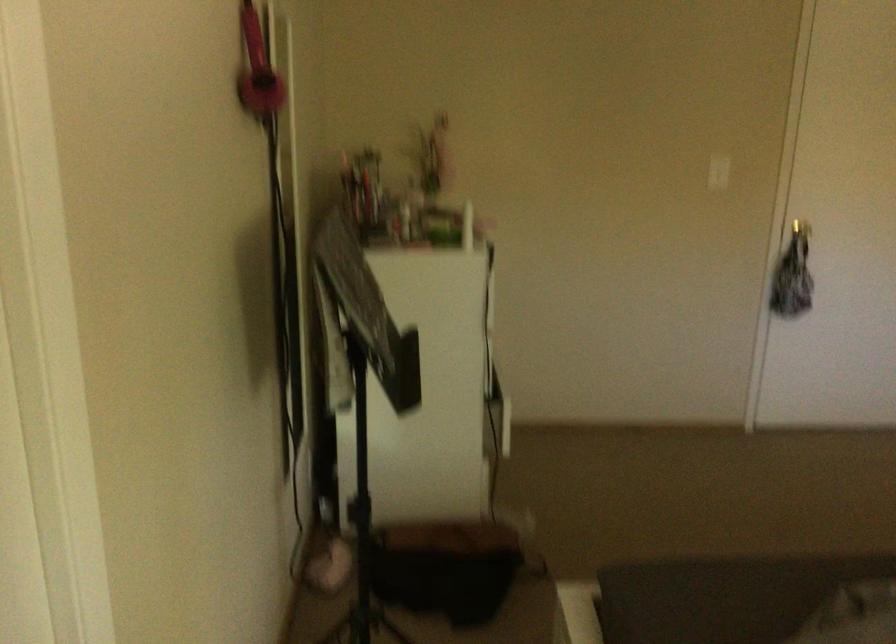
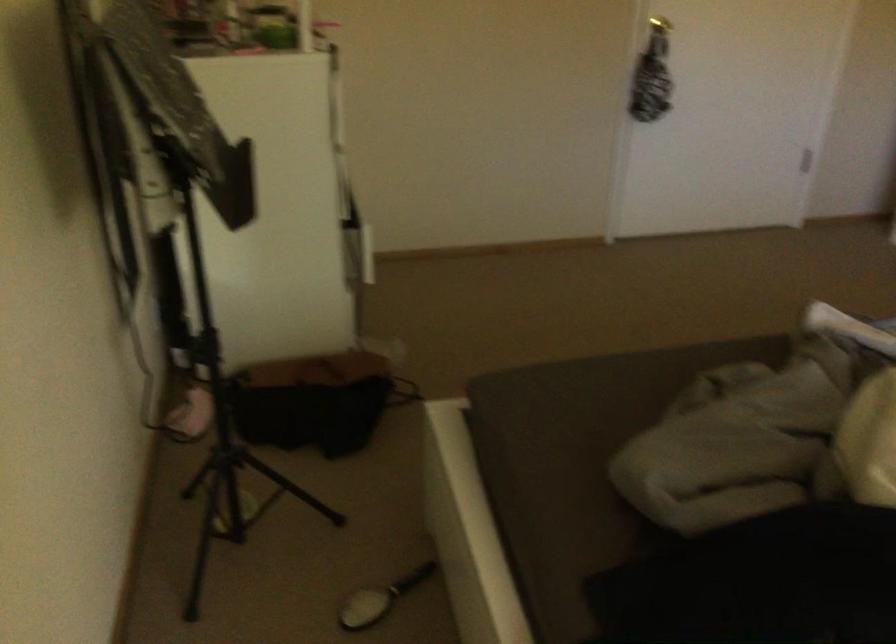
Question: The first image is from the beginning of the video and the second image is from the end. How did the camera likely rotate when shooting the video?

Choices:
 (A) Left
 (B) Right
 (C) Up
 (D) Down

Answer: (D)